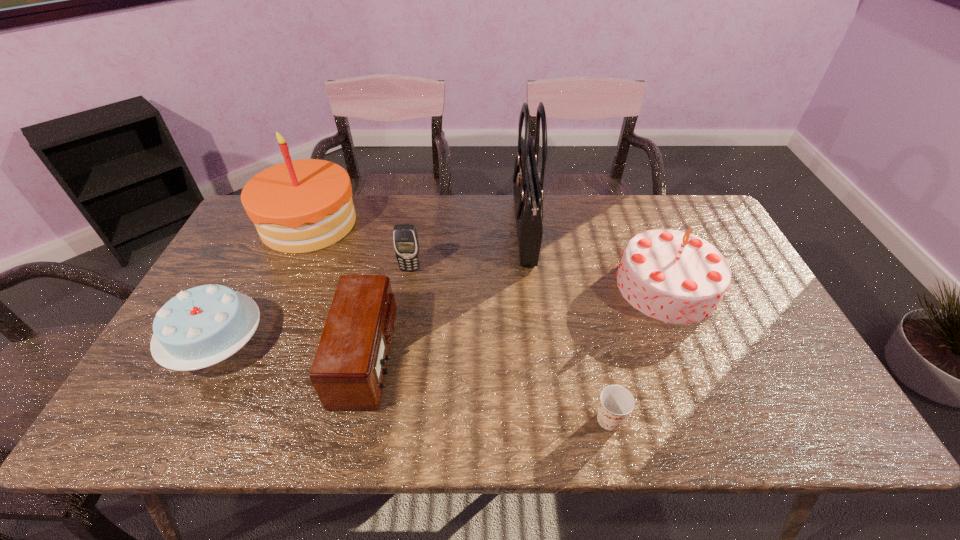
I want to click on birthday cake that is at the far edge, so pyautogui.click(x=299, y=206).

Where is `radio receiver that is at the near edge`? The width and height of the screenshot is (960, 540). radio receiver that is at the near edge is located at coordinates (348, 371).

Locate an element on the screen. The width and height of the screenshot is (960, 540). Dixie cup at the near edge is located at coordinates [616, 402].

Locate an element on the screen. The image size is (960, 540). object present at the right edge is located at coordinates (676, 277).

I want to click on object present at the far left corner, so click(x=299, y=206).

Locate an element on the screen. vacant space at the far edge of the desktop is located at coordinates (395, 210).

In the image, there is a desktop. Identify the location of blank space at the near edge. The height and width of the screenshot is (540, 960). (385, 414).

You are a GUI agent. You are given a task and a screenshot of the screen. Output one action in this format:
    pyautogui.click(x=<x>, y=<y>)
    Task: Click on the free space at the left edge of the desktop
    
    Given the screenshot: What is the action you would take?
    272,254

You are a GUI agent. You are given a task and a screenshot of the screen. Output one action in this format:
    pyautogui.click(x=<x>, y=<y>)
    Task: Click on the vacant area between the tallest birthday cake and the rightmost object
    This screenshot has width=960, height=540.
    Given the screenshot: What is the action you would take?
    (488, 254)

Locate an element on the screen. This screenshot has height=540, width=960. free space between the Dixie cup and the rightmost object is located at coordinates (638, 353).